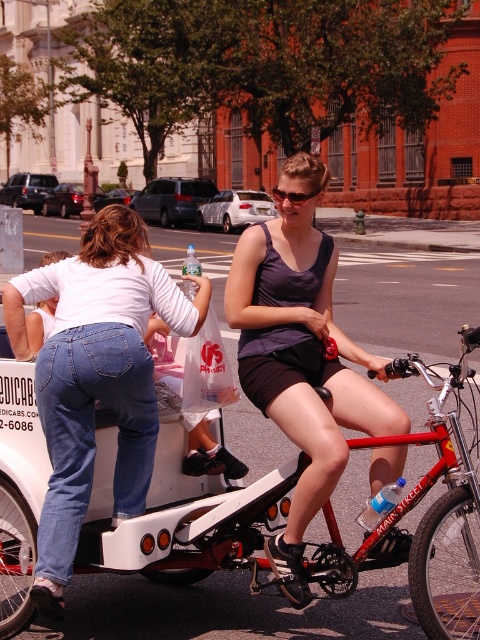
Describe the element at coordinates (300, 355) in the screenshot. I see `matte purple tank top at center` at that location.

Is point (294, 593) farther from viewer compared to point (402, 364)?

Yes.

Where is `matte purple tank top at center`? matte purple tank top at center is located at coordinates (300, 355).

Between denim shorts at center and matte purple tank top at center, which one appears on the left side from the viewer's perspective?

denim shorts at center is more to the left.

Between denim shorts at center and matte purple tank top at center, which one is positioned lower?

denim shorts at center is lower down.

The height and width of the screenshot is (640, 480). I want to click on denim shorts at center, so click(96, 378).

Is denim shorts at center taller than red matte bicycle at center?

Correct, denim shorts at center is much taller as red matte bicycle at center.

What do you see at coordinates (96, 378) in the screenshot?
I see `denim shorts at center` at bounding box center [96, 378].

Is point (129, 410) positioned behind point (316, 548)?

No, it is in front of (316, 548).

Where is `denim shorts at center`? denim shorts at center is located at coordinates (96, 378).